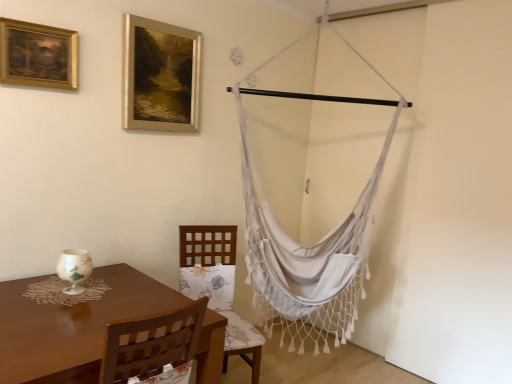
The height and width of the screenshot is (384, 512). I want to click on vacant space situated above brown wooden table at lower left (from a real-world perspective), so click(99, 289).